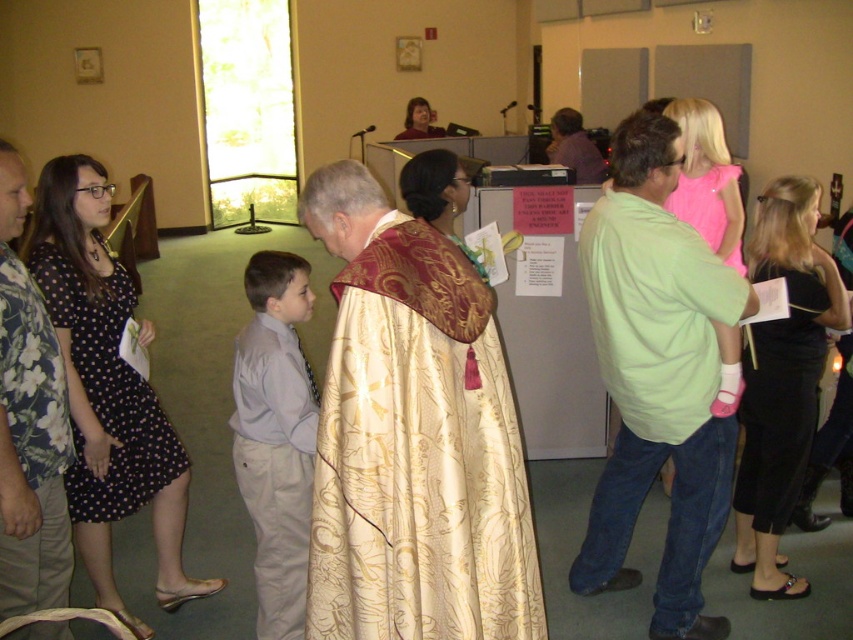
Is the position of black dotted dress at left less distant than that of matte purple shirt at center?

Yes, black dotted dress at left is closer to the viewer.

Does black dotted dress at left have a larger size compared to matte purple shirt at center?

Indeed, black dotted dress at left has a larger size compared to matte purple shirt at center.

Locate an element on the screen. The width and height of the screenshot is (853, 640). black dotted dress at left is located at coordinates (106, 388).

Can you confirm if gold embroidered robe at center is positioned to the right of matte gold robe at upper center?

No, gold embroidered robe at center is not to the right of matte gold robe at upper center.

Does gold embroidered robe at center appear under matte gold robe at upper center?

Yes.

What do you see at coordinates (107, 392) in the screenshot? I see `gold embroidered robe at center` at bounding box center [107, 392].

At what (x,y) coordinates should I click in order to perform the action: click on gold embroidered robe at center. Please return your answer as a coordinate pair (x, y). Looking at the image, I should click on (107, 392).

Is light green cotton shirt at center closer to camera compared to gold embroidered robe at center?

Yes, light green cotton shirt at center is in front of gold embroidered robe at center.

Is point (611, 316) positioned behind point (78, 483)?

That is False.

You are a GUI agent. You are given a task and a screenshot of the screen. Output one action in this format:
    pyautogui.click(x=<x>, y=<y>)
    Task: Click on the light green cotton shirt at center
    The image size is (853, 640).
    Given the screenshot: What is the action you would take?
    pyautogui.click(x=659, y=376)